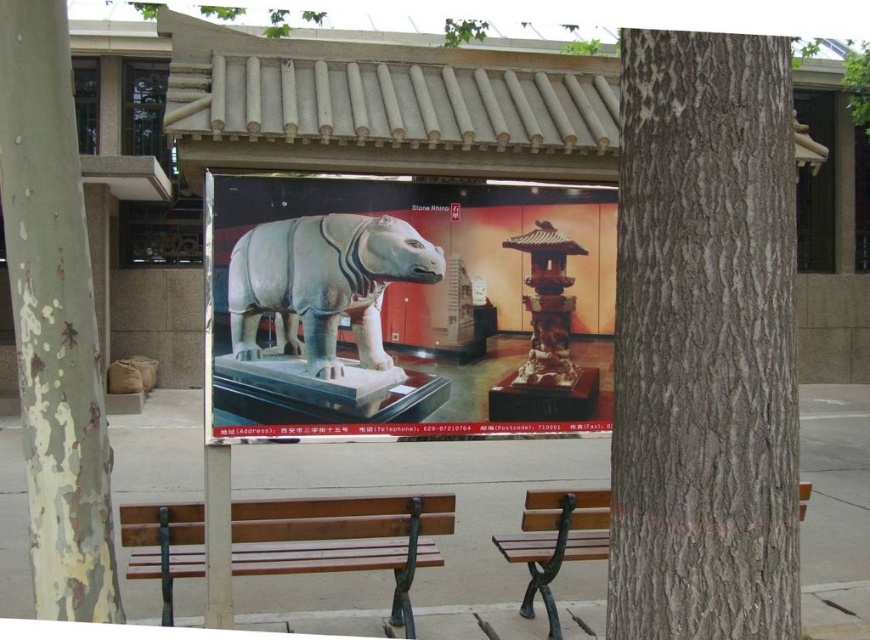
Does gray rough bark tree at right appear on the right side of wooden bench at center?

Indeed, gray rough bark tree at right is positioned on the right side of wooden bench at center.

Which is behind, point (761, 208) or point (203, 525)?

Positioned behind is point (203, 525).

What do you see at coordinates (704, 342) in the screenshot? I see `gray rough bark tree at right` at bounding box center [704, 342].

Locate an element on the screen. This screenshot has width=870, height=640. gray rough bark tree at right is located at coordinates (x=704, y=342).

From the picture: Is white stone rhino at center to the left of polished bronze pagoda at center from the viewer's perspective?

Yes, white stone rhino at center is to the left of polished bronze pagoda at center.

Can you confirm if white stone rhino at center is shorter than polished bronze pagoda at center?

Correct, white stone rhino at center is not as tall as polished bronze pagoda at center.

Is point (342, 262) closer to camera compared to point (552, 228)?

Yes, it is.

This screenshot has height=640, width=870. What are the coordinates of `white stone rhino at center` in the screenshot? It's located at (323, 284).

Does white stone rhino at center lie behind brown wooden bench at center?

Yes, white stone rhino at center is further from the viewer.

Which is behind, point (419, 253) or point (550, 637)?

Point (550, 637)

Where is `white stone rhino at center`? The image size is (870, 640). white stone rhino at center is located at coordinates (323, 284).